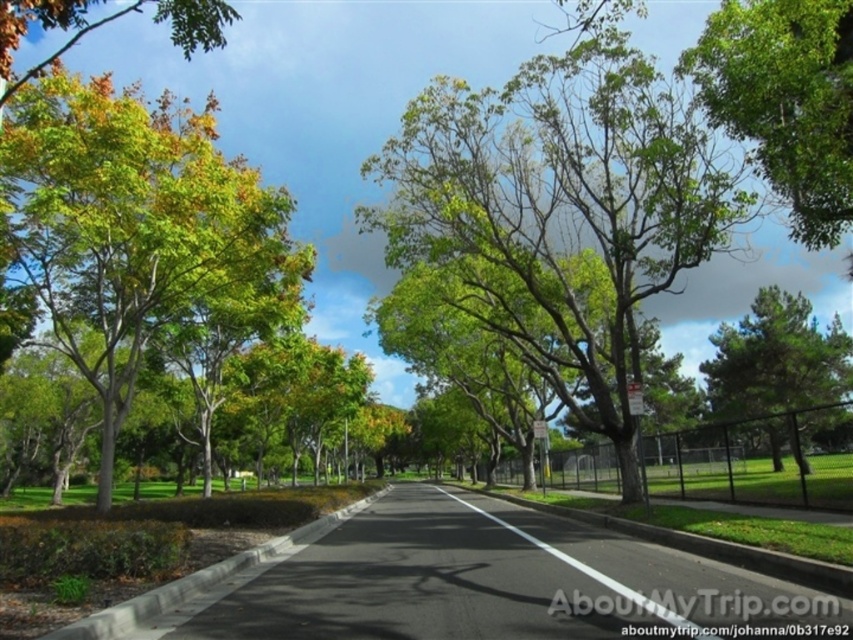
Between green leafy tree at left and green leafy tree at upper left, which one is positioned higher?

green leafy tree at upper left is higher up.

Is green leafy tree at left taller than green leafy tree at upper left?

No, green leafy tree at left is not taller than green leafy tree at upper left.

Is point (144, 218) positioned behind point (231, 10)?

Yes, it is behind point (231, 10).

I want to click on green leafy tree at left, so click(x=137, y=228).

Can you confirm if green leafy tree at upper right is positioned to the left of green leafy tree at upper left?

Incorrect, green leafy tree at upper right is not on the left side of green leafy tree at upper left.

Can you confirm if green leafy tree at upper right is shorter than green leafy tree at upper left?

Yes.

The width and height of the screenshot is (853, 640). What are the coordinates of `green leafy tree at upper right` in the screenshot? It's located at (785, 100).

What do you see at coordinates (137, 228) in the screenshot? I see `green leafy tree at left` at bounding box center [137, 228].

Is green leafy tree at left to the right of green textured pine tree at right from the viewer's perspective?

In fact, green leafy tree at left is to the left of green textured pine tree at right.

This screenshot has height=640, width=853. In order to click on green leafy tree at left in this screenshot , I will do pos(137,228).